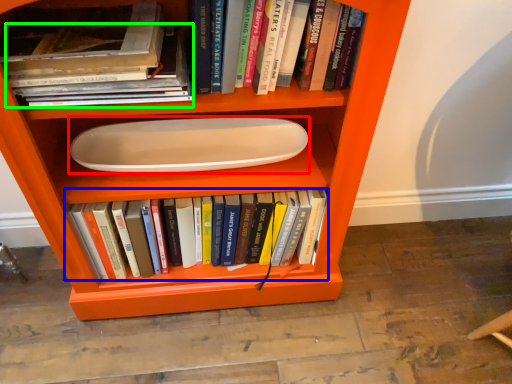
Question: Which object is the closest to the paper plate (highlighted by a red box)? Choose among these: book (highlighted by a blue box) or book (highlighted by a green box).

Choices:
 (A) book
 (B) book

Answer: (A)